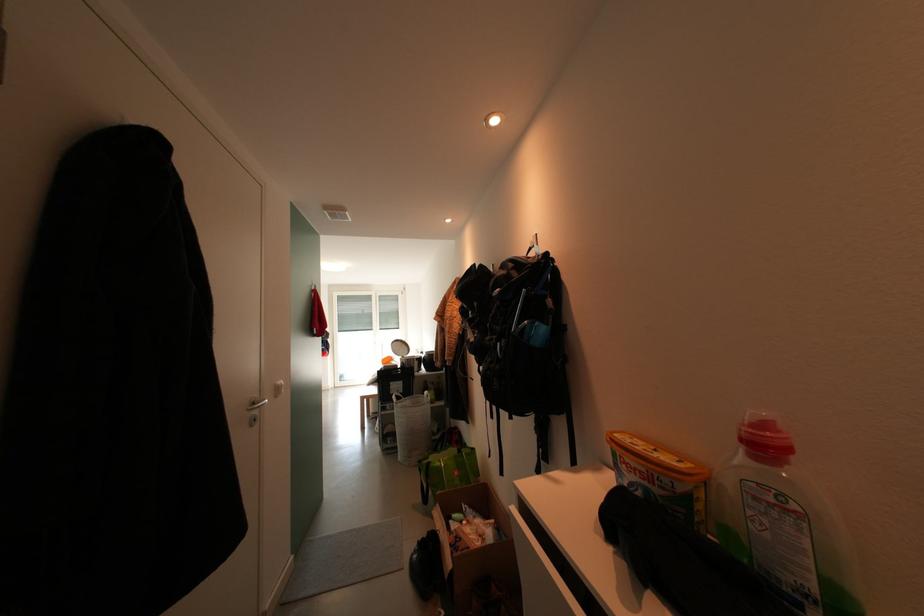
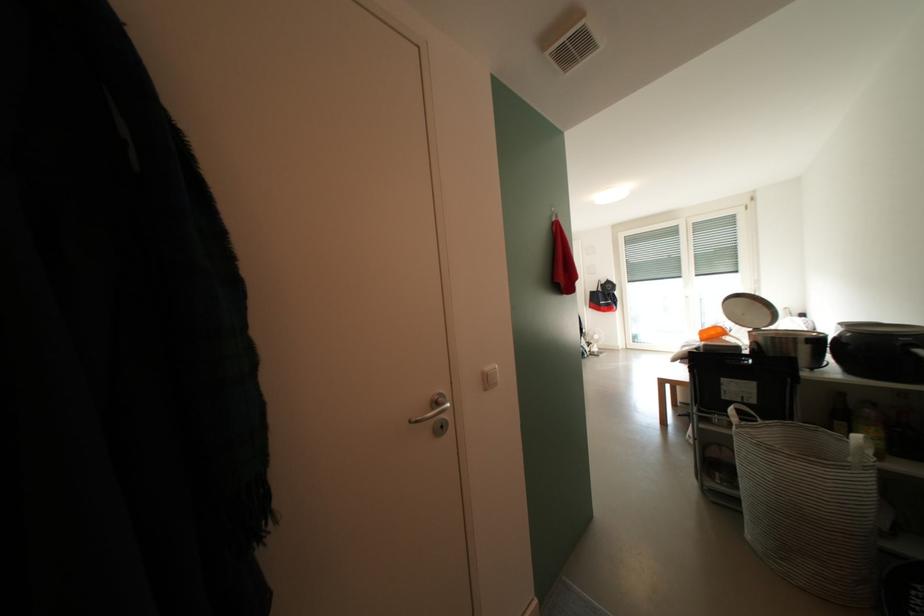
Where in the second image is the point corresponding to pixel 415 405 from the first image?

(779, 435)